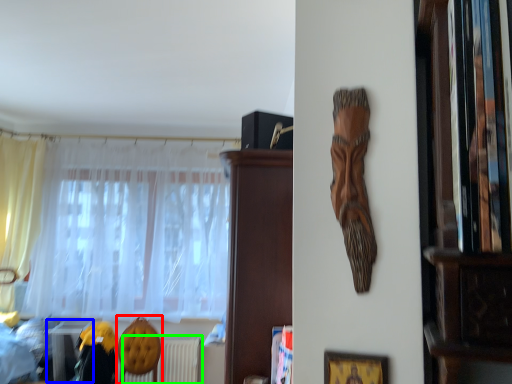
Question: Which object is positioned farthest from armchair (highlighted by a red box)? Select from table (highlighted by a blue box) and radiator (highlighted by a green box).

Choices:
 (A) table
 (B) radiator

Answer: (A)